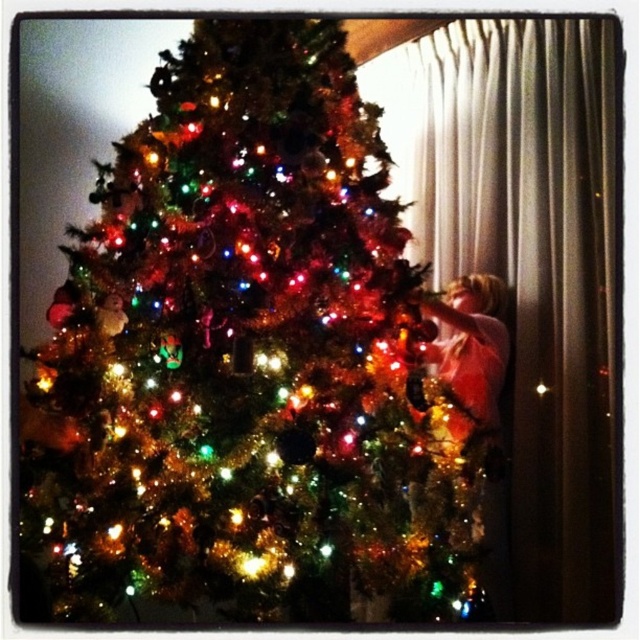
Question: Which object appears closest to the camera in this image?

Choices:
 (A) iridescent shiny tree at center
 (B) shiny gold dress at right

Answer: (A)

Question: Can you confirm if iridescent shiny tree at center is wider than shiny gold dress at right?

Choices:
 (A) yes
 (B) no

Answer: (A)

Question: Which point is closer to the camera taking this photo?

Choices:
 (A) (454, 435)
 (B) (170, 129)

Answer: (A)

Question: Is iridescent shiny tree at center thinner than shiny gold dress at right?

Choices:
 (A) yes
 (B) no

Answer: (B)

Question: From the image, what is the correct spatial relationship of iridescent shiny tree at center in relation to shiny gold dress at right?

Choices:
 (A) right
 (B) left

Answer: (B)

Question: Which point appears farthest from the camera in this image?

Choices:
 (A) (304, 340)
 (B) (474, 365)

Answer: (B)